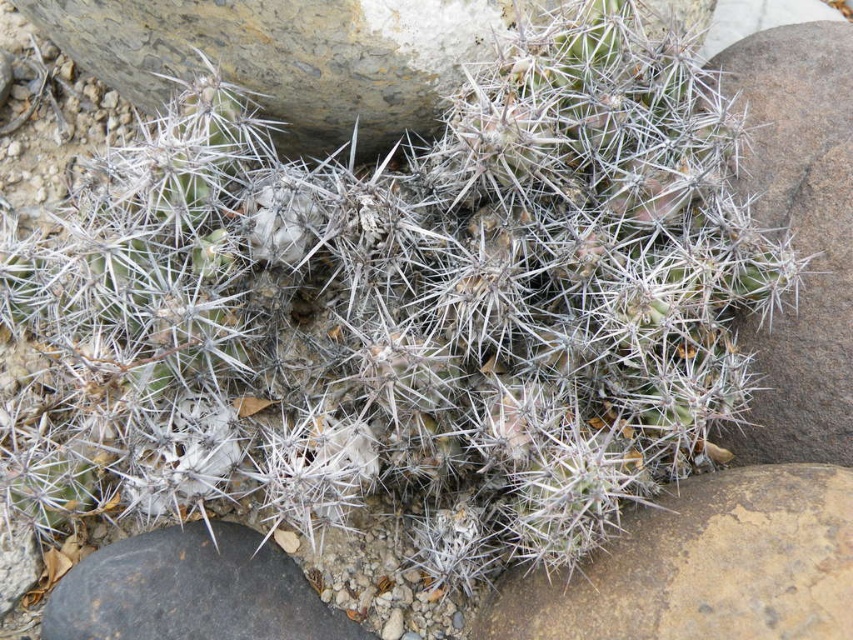
Based on the photo, you are standing in front of the cluster of cacti and notice a point marked at coordinates (703, 566). What object is located at that point?

The point at coordinates (703, 566) marks a brown rough stone at lower right.

You are standing in front of the cluster of cacti and notice two points marked on the ground. The first point is at coordinate point (x=608, y=614) and the second is at point (x=140, y=618). Which point is closer to you?

Point (x=608, y=614) is closer to the viewer than point (x=140, y=618).